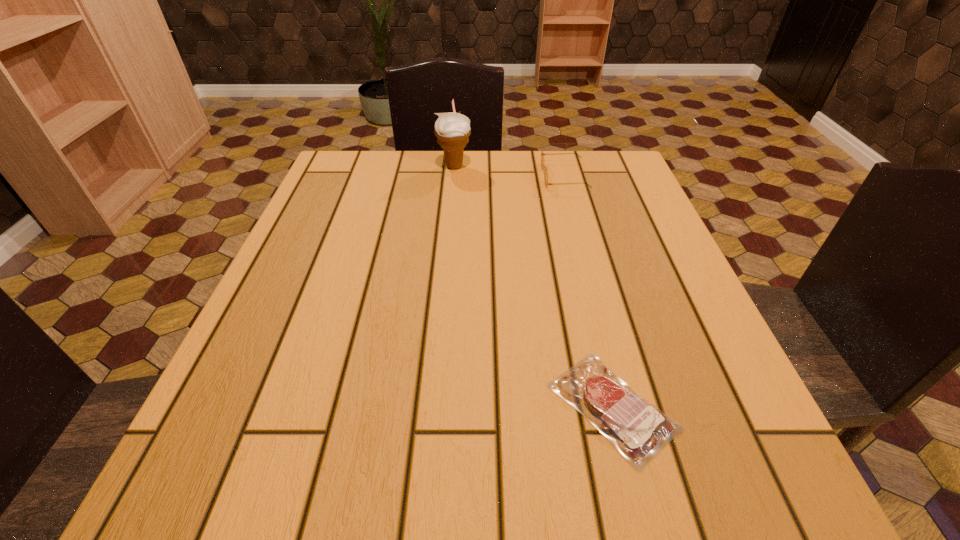
Find the location of a particular element. the leftmost object is located at coordinates (453, 130).

In order to click on icecream in this screenshot , I will do `click(453, 130)`.

What are the coordinates of `the second tallest object` in the screenshot? It's located at (544, 168).

At what (x,y) coordinates should I click in order to perform the action: click on the nearest object. Please return your answer as a coordinate pair (x, y). The height and width of the screenshot is (540, 960). Looking at the image, I should click on click(x=642, y=430).

You are a GUI agent. You are given a task and a screenshot of the screen. Output one action in this format:
    pyautogui.click(x=<x>, y=<y>)
    Task: Click on the shortest object
    
    Given the screenshot: What is the action you would take?
    pyautogui.click(x=642, y=430)

Where is `vacant space situated on the front of the leftmost object`? Image resolution: width=960 pixels, height=540 pixels. vacant space situated on the front of the leftmost object is located at coordinates (448, 233).

Identify the location of blank area located 0.120m on the face of the sunglasses. Image resolution: width=960 pixels, height=540 pixels. (495, 176).

At what (x,y) coordinates should I click in order to perform the action: click on free space located on the face of the sunglasses. Please return your answer as a coordinate pair (x, y). Looking at the image, I should click on (511, 176).

You are a GUI agent. You are given a task and a screenshot of the screen. Output one action in this format:
    pyautogui.click(x=<x>, y=<y>)
    Task: Click on the free location located on the face of the sunglasses
    The width and height of the screenshot is (960, 540).
    Given the screenshot: What is the action you would take?
    pyautogui.click(x=402, y=176)

Find the location of `free spot located on the left of the nearest object`. free spot located on the left of the nearest object is located at coordinates (332, 406).